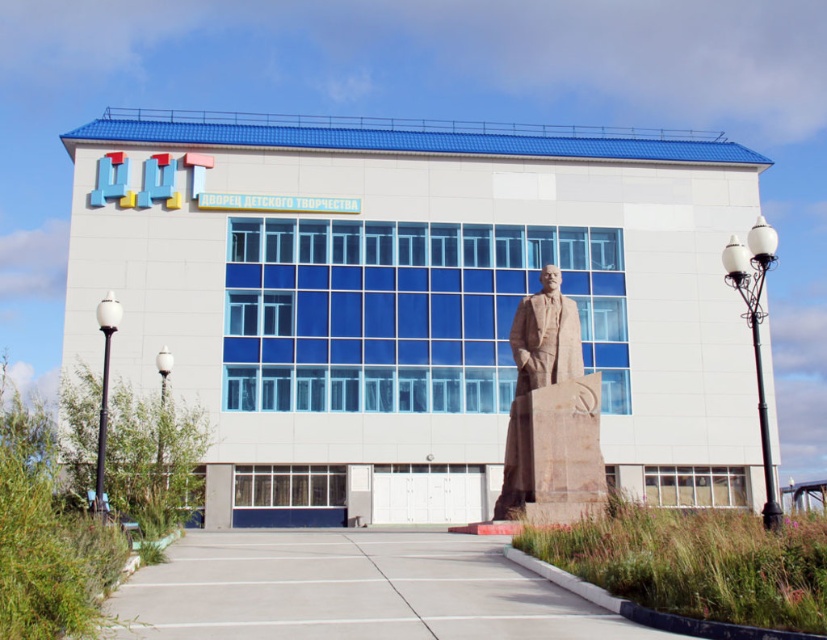
Question: Is polished stone statue at center below white glass lamp post at left?

Choices:
 (A) yes
 (B) no

Answer: (B)

Question: Which point is closer to the camera?

Choices:
 (A) brown stone statue at center
 (B) white glass lamp post at left

Answer: (B)

Question: Which point is farther from the camera taking this photo?

Choices:
 (A) click(x=103, y=314)
 (B) click(x=161, y=422)
 (C) click(x=754, y=288)

Answer: (B)

Question: Observing the image, what is the correct spatial positioning of polished stone statue at center in reference to brown stone statue at center?

Choices:
 (A) below
 (B) above

Answer: (B)

Question: Is black wrought iron streetlight at right positioned behind white glass lamp post at left?

Choices:
 (A) yes
 (B) no

Answer: (B)

Question: Which object is positioned closest to the white glass lamp post at left?

Choices:
 (A) polished stone statue at center
 (B) brown stone statue at center

Answer: (B)